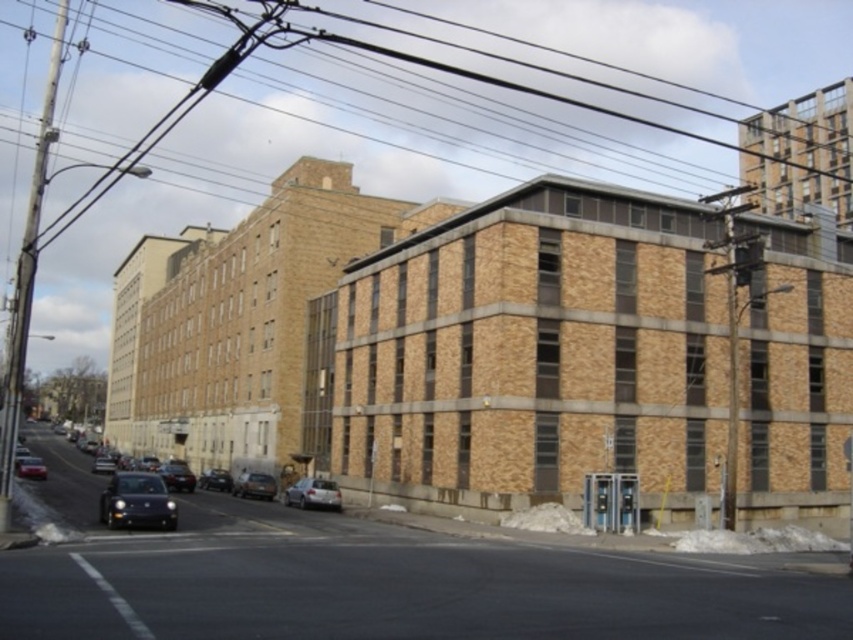
You are a delivery person standing on the sidewalk in front of the building. You need to park your silver metallic car at center in a spot that is 0.8 meters away from the building. Is the current position of the car suitable?

The silver metallic car at center is positioned at point (312,493). Since the required parking spot is 0.8 meters away from the building, the current position may not be suitable as the coordinates do not directly indicate the distance from the building. Further measurement is needed to confirm.